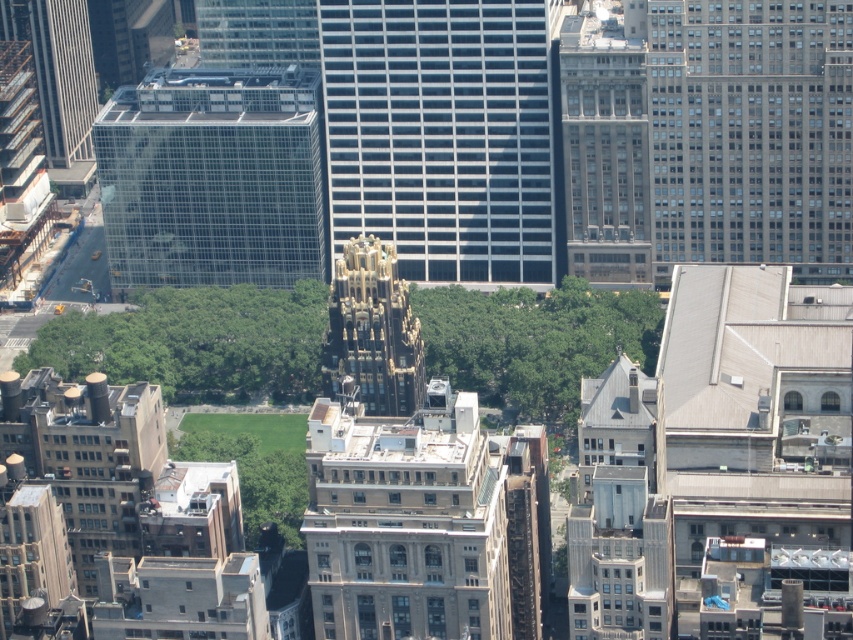
You are a drone operator trying to navigate between two buildings in the city. You see the transparent glass building at upper left and the gold textured building at center. Which building is positioned to the left of the other?

The transparent glass building at upper left is positioned to the left of the gold textured building at center.